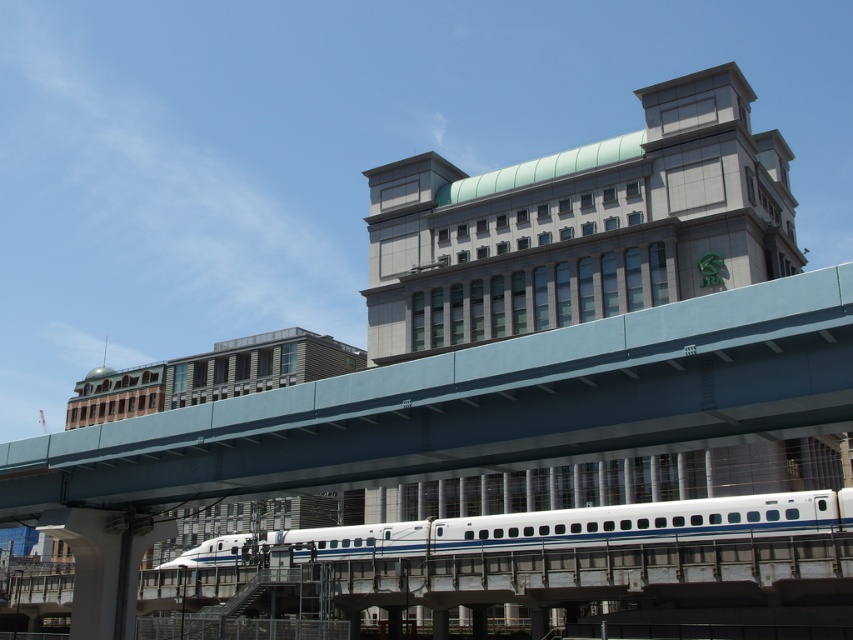
Question: Where is smooth concrete overpass at center located in relation to white glossy passenger train at center in the image?

Choices:
 (A) below
 (B) above

Answer: (B)

Question: Is smooth concrete overpass at center to the right of white glossy passenger train at center from the viewer's perspective?

Choices:
 (A) no
 (B) yes

Answer: (A)

Question: Which point is farther from the camera taking this photo?

Choices:
 (A) (828, 500)
 (B) (682, 412)

Answer: (A)

Question: Is smooth concrete overpass at center further to the viewer compared to white glossy passenger train at center?

Choices:
 (A) no
 (B) yes

Answer: (A)

Question: Among these points, which one is nearest to the camera?

Choices:
 (A) (178, 460)
 (B) (430, 528)

Answer: (A)

Question: Which point is closer to the camera?

Choices:
 (A) smooth concrete overpass at center
 (B) white glossy passenger train at center

Answer: (A)